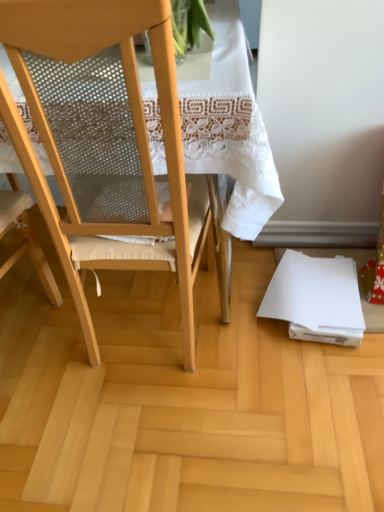
The height and width of the screenshot is (512, 384). Find the location of `free point to the right of matte wood chair at center`. free point to the right of matte wood chair at center is located at coordinates (250, 324).